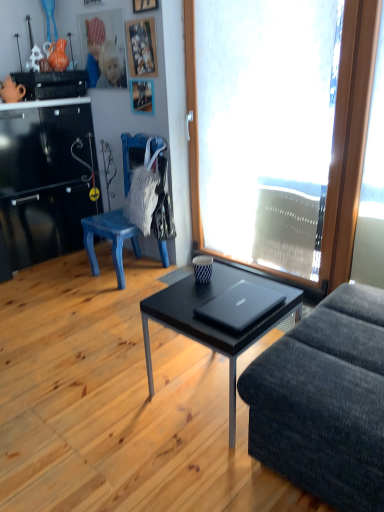
Question: Can you confirm if black matte coffee table at center is smaller than wooden picture frame at upper center, the second picture frame in the top-to-bottom sequence?

Choices:
 (A) no
 (B) yes

Answer: (A)

Question: Is black matte coffee table at center turned away from wooden picture frame at upper center, the second picture frame in the top-to-bottom sequence?

Choices:
 (A) yes
 (B) no

Answer: (B)

Question: Is black matte coffee table at center aimed at wooden picture frame at upper center, the second picture frame in the top-to-bottom sequence?

Choices:
 (A) yes
 (B) no

Answer: (B)

Question: From the image's perspective, is black matte coffee table at center under wooden picture frame at upper center, which ranks as the 2th picture frame in bottom-to-top order?

Choices:
 (A) no
 (B) yes

Answer: (B)

Question: From the image's perspective, is black matte coffee table at center on wooden picture frame at upper center, the second picture frame in the top-to-bottom sequence?

Choices:
 (A) yes
 (B) no

Answer: (B)

Question: Relative to black matte coffee table at center, is wooden picture frame at upper center, acting as the first picture frame starting from the bottom, in front or behind?

Choices:
 (A) behind
 (B) front

Answer: (A)

Question: From their relative heights in the image, would you say wooden picture frame at upper center, acting as the first picture frame starting from the bottom, is taller or shorter than black matte coffee table at center?

Choices:
 (A) tall
 (B) short

Answer: (B)

Question: Is wooden picture frame at upper center, marked as the 3th picture frame in a top-to-bottom arrangement, bigger or smaller than black matte coffee table at center?

Choices:
 (A) big
 (B) small

Answer: (B)

Question: From a real-world perspective, is wooden picture frame at upper center, acting as the first picture frame starting from the bottom, positioned above or below black matte coffee table at center?

Choices:
 (A) below
 (B) above

Answer: (B)

Question: Is wooden picture frame at upper center, the second picture frame in the top-to-bottom sequence, bigger or smaller than wooden picture frame at upper center, acting as the first picture frame starting from the bottom?

Choices:
 (A) big
 (B) small

Answer: (A)

Question: From the image's perspective, is wooden picture frame at upper center, the second picture frame in the top-to-bottom sequence, positioned above or below wooden picture frame at upper center, acting as the first picture frame starting from the bottom?

Choices:
 (A) above
 (B) below

Answer: (A)

Question: Which is correct: wooden picture frame at upper center, which ranks as the 2th picture frame in bottom-to-top order, is inside wooden picture frame at upper center, acting as the first picture frame starting from the bottom, or outside of it?

Choices:
 (A) outside
 (B) inside

Answer: (A)

Question: Is wooden picture frame at upper center, the second picture frame in the top-to-bottom sequence, wider or thinner than wooden picture frame at upper center, acting as the first picture frame starting from the bottom?

Choices:
 (A) thin
 (B) wide

Answer: (A)

Question: Is transparent glass window at center wider or thinner than wooden picture frame at upper center, acting as the first picture frame starting from the bottom?

Choices:
 (A) thin
 (B) wide

Answer: (B)

Question: Is transparent glass window at center taller or shorter than wooden picture frame at upper center, marked as the 3th picture frame in a top-to-bottom arrangement?

Choices:
 (A) tall
 (B) short

Answer: (A)